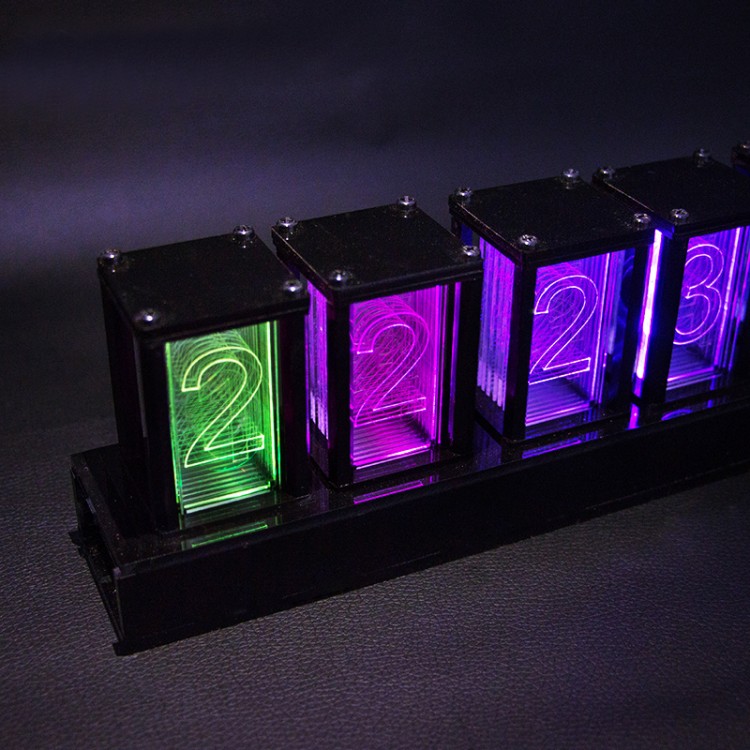
Identify the location of pink light. (421, 375).